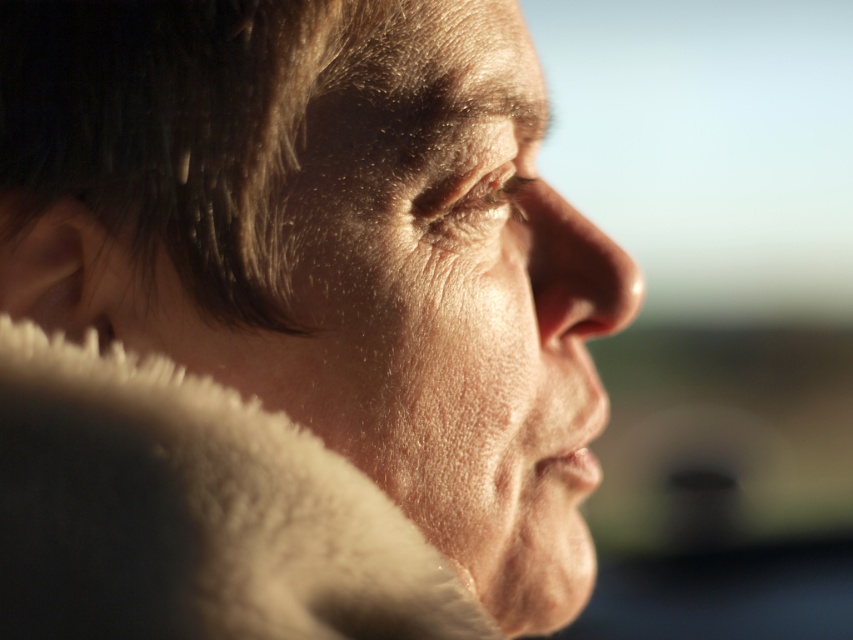
Question: In this image, where is white fluffy fur coat at lower left located relative to smooth skin nose at center?

Choices:
 (A) below
 (B) above

Answer: (A)

Question: Which of the following is the closest to the observer?

Choices:
 (A) white fluffy fur coat at lower left
 (B) smooth skin nose at center

Answer: (A)

Question: Can you confirm if white fluffy fur coat at lower left is positioned above smooth skin nose at center?

Choices:
 (A) no
 (B) yes

Answer: (A)

Question: Is white fluffy fur coat at lower left smaller than smooth skin nose at center?

Choices:
 (A) yes
 (B) no

Answer: (B)

Question: Among these points, which one is nearest to the camera?

Choices:
 (A) (119, 362)
 (B) (612, 305)

Answer: (A)

Question: Which object is farther from the camera taking this photo?

Choices:
 (A) smooth skin nose at center
 (B) white fluffy fur coat at lower left

Answer: (A)